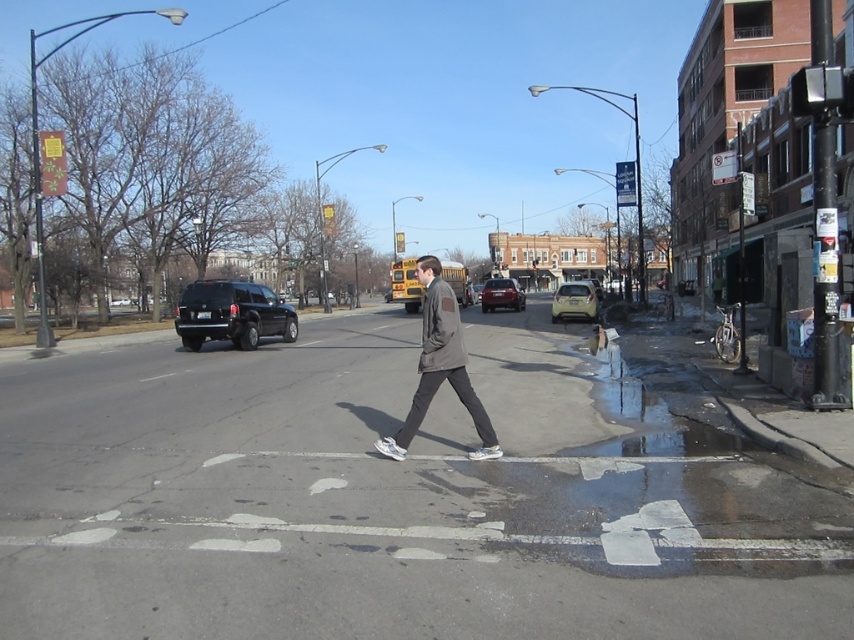
You are a delivery drone flying over an urban street scene. You need to land precisely on the matte gray crosswalk at center. Given that your landing coordinates must be within 0.05 units of the crosswalk, can you confirm if your current position at point 0.78 is within the required range?

The matte gray crosswalk at center is at point 0.781, so your current position at 0.78 is within the required 0.05 units range. You can proceed to land safely.

You are a pedestrian standing at the left side of the street. You see a dark gray fabric jacket at center and a matte red car at center. Which object is closer to your current position?

The dark gray fabric jacket at center is closer to your current position because it is to the left of the matte red car at center.

You are a pedestrian standing at the crosswalk in the image. You want to cross the street to the other side. There are two cars parked at the center of the street, a metallic gold car at center and a matte red car at center. Given that the distance between them is 8.94 meters, can you safely cross the street between them without needing to walk around?

The metallic gold car at center and the matte red car at center are 8.94 meters apart. Since the distance between them is sufficient for a pedestrian to cross safely, you can walk between them without needing to go around.